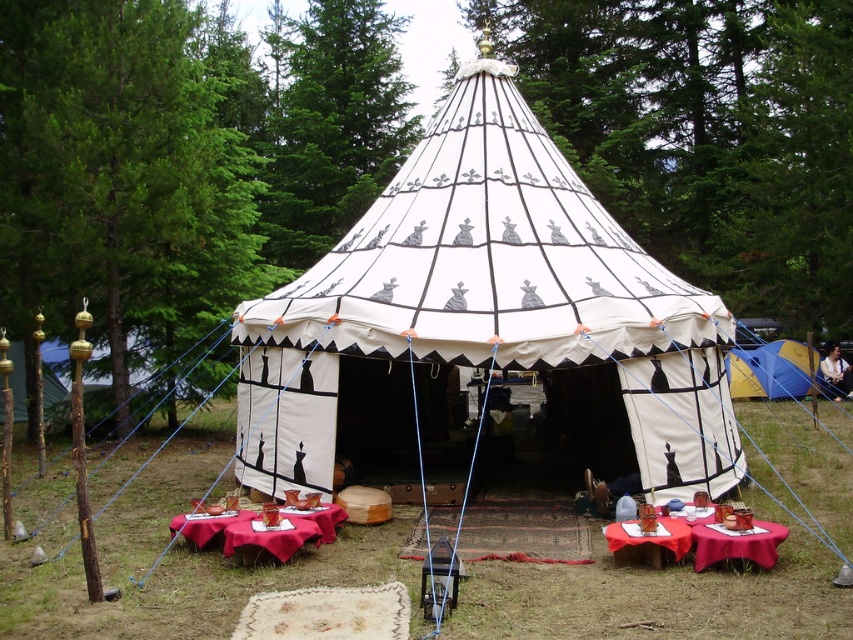
Who is higher up, white canvas tent at center or blue canvas tent at right?

white canvas tent at center is higher up.

Does white canvas tent at center have a larger size compared to blue canvas tent at right?

Yes.

The height and width of the screenshot is (640, 853). What are the coordinates of `white canvas tent at center` in the screenshot? It's located at (488, 301).

Between point (688, 317) and point (621, 531), which one is positioned in front?

Point (621, 531) is more forward.

Which is below, white canvas tent at center or smooth red tablecloth at lower center?

Positioned lower is smooth red tablecloth at lower center.

Who is more forward, [381,339] or [764,566]?

Positioned in front is point [764,566].

Find the location of `white canvas tent at center`. white canvas tent at center is located at coordinates (488, 301).

Can you confirm if white canvas tent at center is bigger than smooth wooden table at lower center?

Yes, white canvas tent at center is bigger than smooth wooden table at lower center.

Consider the image. Who is positioned more to the right, white canvas tent at center or smooth wooden table at lower center?

From the viewer's perspective, smooth wooden table at lower center appears more on the right side.

What are the coordinates of `white canvas tent at center` in the screenshot? It's located at (488, 301).